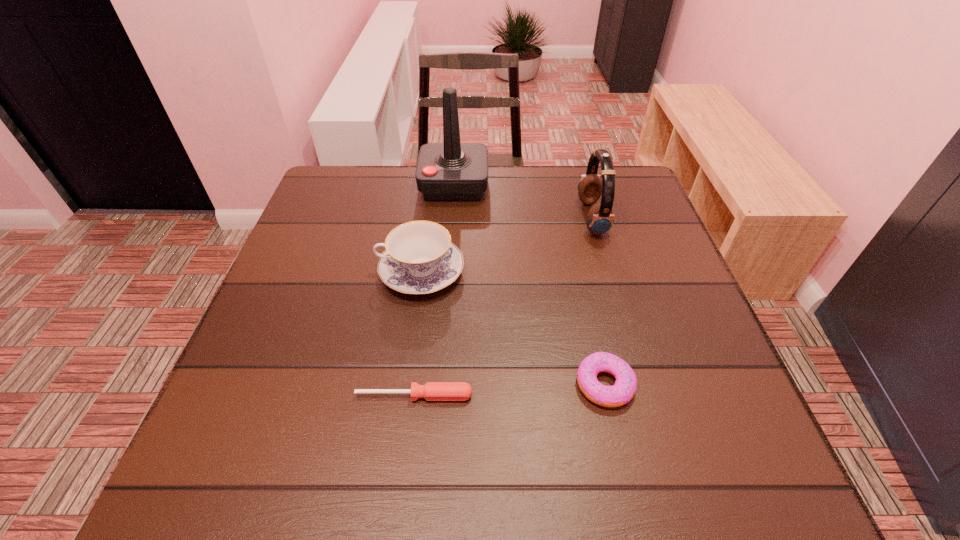
Identify the location of vacant space situated with the handle on the side of the third shortest object. (316, 272).

Find the location of a particular element. Image resolution: width=960 pixels, height=540 pixels. free space located with the handle on the side of the third shortest object is located at coordinates (294, 272).

You are a GUI agent. You are given a task and a screenshot of the screen. Output one action in this format:
    pyautogui.click(x=<x>, y=<y>)
    Task: Click on the free space located with the handle on the side of the third shortest object
    
    Given the screenshot: What is the action you would take?
    pyautogui.click(x=342, y=272)

This screenshot has height=540, width=960. Identify the location of vacant space situated 0.250m on the left of the doughnut. (438, 384).

This screenshot has width=960, height=540. What are the coordinates of `free space located 0.180m on the right of the screwdriver` in the screenshot? It's located at (574, 396).

Image resolution: width=960 pixels, height=540 pixels. I want to click on joystick that is at the far edge, so click(x=450, y=171).

You are a GUI agent. You are given a task and a screenshot of the screen. Output one action in this format:
    pyautogui.click(x=<x>, y=<y>)
    Task: Click on the headset at the far edge
    This screenshot has height=540, width=960.
    Given the screenshot: What is the action you would take?
    click(x=599, y=220)

Where is `object present at the right edge`? object present at the right edge is located at coordinates (599, 220).

This screenshot has width=960, height=540. Identify the location of object that is at the far right corner. (599, 220).

Where is `vacant space at the far edge of the desktop`? Image resolution: width=960 pixels, height=540 pixels. vacant space at the far edge of the desktop is located at coordinates (559, 167).